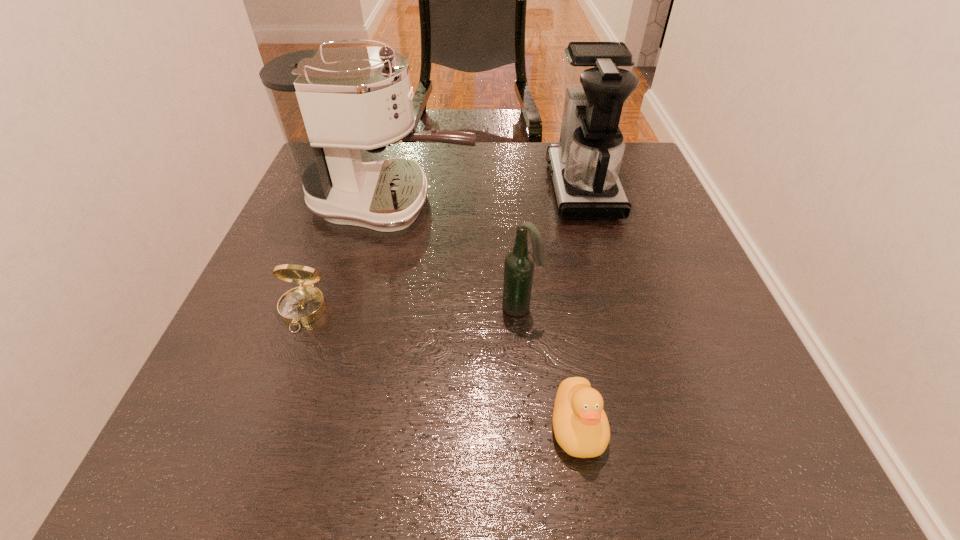
What are the coordinates of `free area in between the shorter coffee maker and the duck` in the screenshot? It's located at (580, 307).

Locate an element on the screen. free spot between the compass and the left coffee maker is located at coordinates (348, 257).

What are the coordinates of `free spot between the duck and the left coffee maker` in the screenshot? It's located at (485, 314).

Where is `vacant space that is in between the nearest object and the left coffee maker`? The height and width of the screenshot is (540, 960). vacant space that is in between the nearest object and the left coffee maker is located at coordinates (485, 314).

Locate which object is the closest to the left coffee maker. Please provide its 2D coordinates. Your answer should be formatted as a tuple, i.e. [(x, y)], where the tuple contains the x and y coordinates of a point satisfying the conditions above.

[(302, 305)]

Identify which object is the third nearest to the compass. Please provide its 2D coordinates. Your answer should be formatted as a tuple, i.e. [(x, y)], where the tuple contains the x and y coordinates of a point satisfying the conditions above.

[(581, 428)]

Find the location of a particular element. The image size is (960, 540). free space that satisfies the following two spatial constraints: 1. at the front of the right coffee maker where the controls are located; 2. on the face of the nearest object is located at coordinates pos(651,426).

This screenshot has width=960, height=540. What are the coordinates of `free location that satisfies the following two spatial constraints: 1. on the front-facing side of the left coffee maker; 2. with the dial facing the compass` in the screenshot? It's located at pos(366,311).

Where is `vacant area in the image that satisfies the following two spatial constraints: 1. on the front-facing side of the beer bottle; 2. on the left side of the left coffee maker`? The width and height of the screenshot is (960, 540). vacant area in the image that satisfies the following two spatial constraints: 1. on the front-facing side of the beer bottle; 2. on the left side of the left coffee maker is located at coordinates (367, 307).

You are a GUI agent. You are given a task and a screenshot of the screen. Output one action in this format:
    pyautogui.click(x=<x>, y=<y>)
    Task: Click on the vacant space that satisfies the following two spatial constraints: 1. on the front-facing side of the left coffee maker; 2. on the left side of the beer bottle
    Image resolution: width=960 pixels, height=540 pixels.
    Given the screenshot: What is the action you would take?
    pyautogui.click(x=367, y=307)